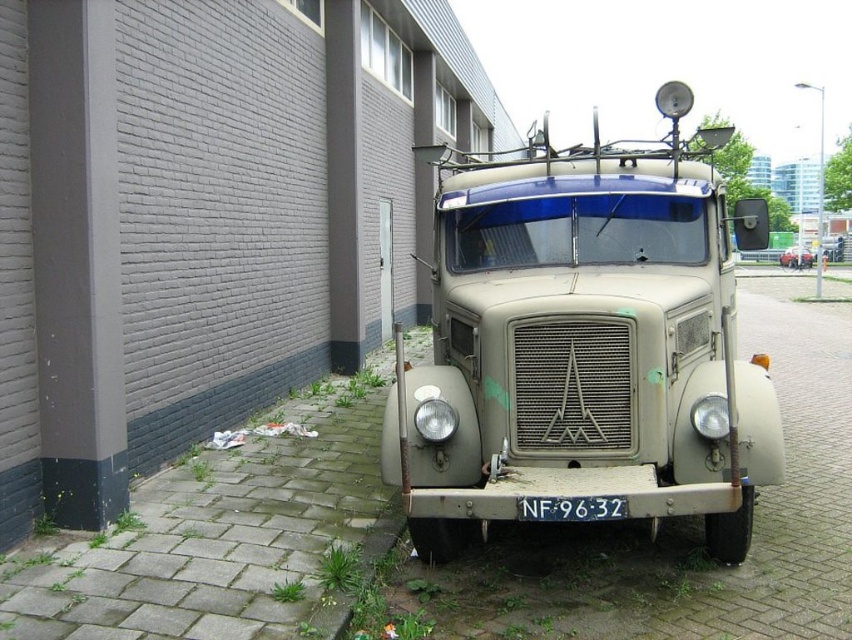
Question: From the image, what is the correct spatial relationship of matte beige truck at center in relation to black plastic license plate at center?

Choices:
 (A) above
 (B) below

Answer: (A)

Question: Is matte beige truck at center bigger than black plastic license plate at center?

Choices:
 (A) no
 (B) yes

Answer: (B)

Question: Is matte beige truck at center to the left of black plastic license plate at center from the viewer's perspective?

Choices:
 (A) no
 (B) yes

Answer: (A)

Question: Which of the following is the closest to the observer?

Choices:
 (A) matte beige truck at center
 (B) black plastic license plate at center

Answer: (B)